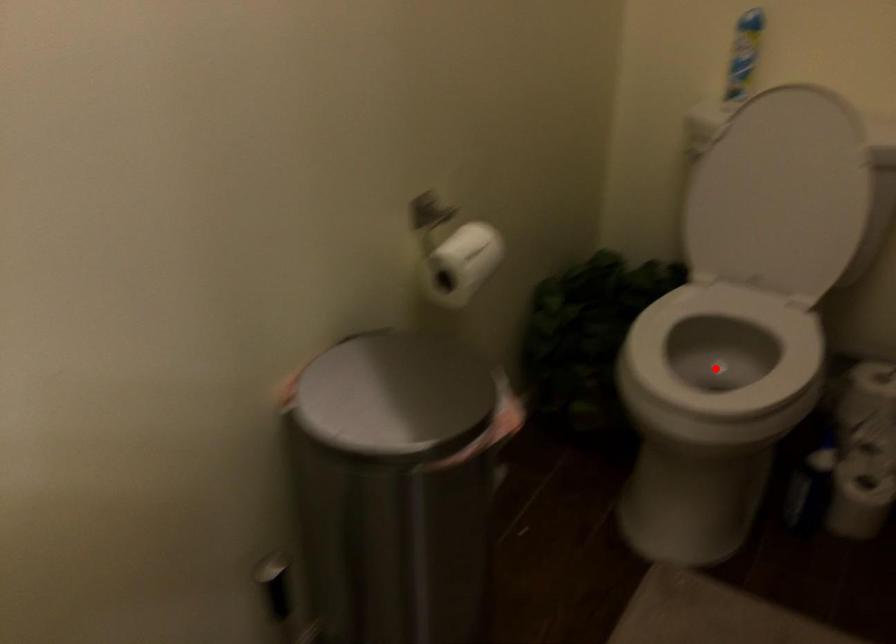
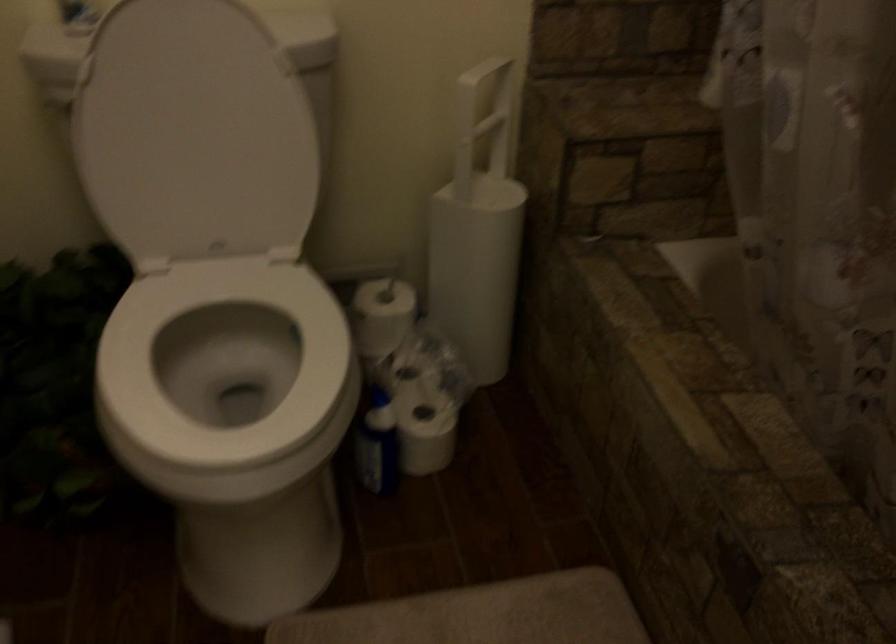
Question: I am providing you with two images of the same scene from different viewpoints. Given a red point in image1, look at the same physical point in image2. Is it:

Choices:
 (A) Closer to the viewpoint
 (B) Farther from the viewpoint

Answer: (A)